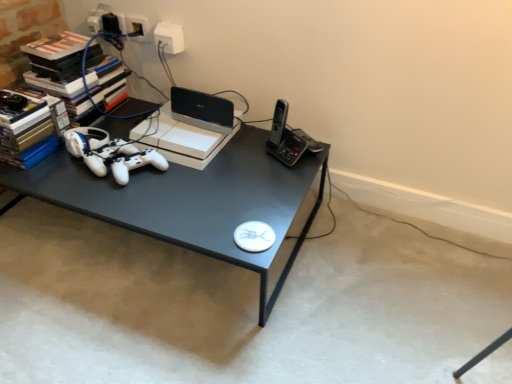
What are the coordinates of `vacant area located to the right-hand side of matte black desk at center` in the screenshot? It's located at (387, 279).